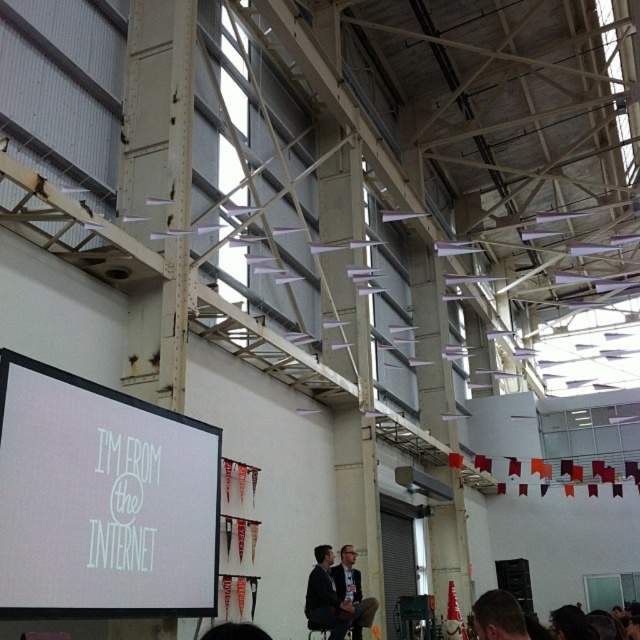
Question: Can you confirm if dark gray suit at center is thinner than brown hair at lower center?

Choices:
 (A) yes
 (B) no

Answer: (B)

Question: Which object is farther from the camera taking this photo?

Choices:
 (A) dark gray suit at center
 (B) brown hair at lower center
 (C) white matte projection screen at upper left
 (D) dark gray suit at lower center

Answer: (D)

Question: Is white matte projection screen at upper left bigger than dark gray suit at lower center?

Choices:
 (A) no
 (B) yes

Answer: (B)

Question: Which object is positioned closest to the white matte projection screen at upper left?

Choices:
 (A) dark gray suit at lower center
 (B) brown hair at lower center

Answer: (B)

Question: Is dark gray suit at center positioned behind brown hair at lower center?

Choices:
 (A) yes
 (B) no

Answer: (A)

Question: Which point appears closest to the camera in this image?

Choices:
 (A) (493, 612)
 (B) (362, 600)
 (C) (65, 420)

Answer: (A)